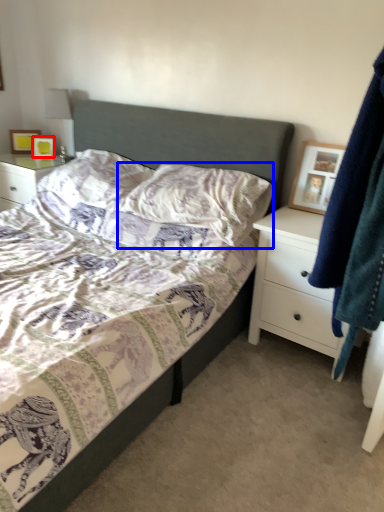
Question: Which object appears farthest to the camera in this image, picture frame (highlighted by a red box) or pillow (highlighted by a blue box)?

Choices:
 (A) picture frame
 (B) pillow

Answer: (A)